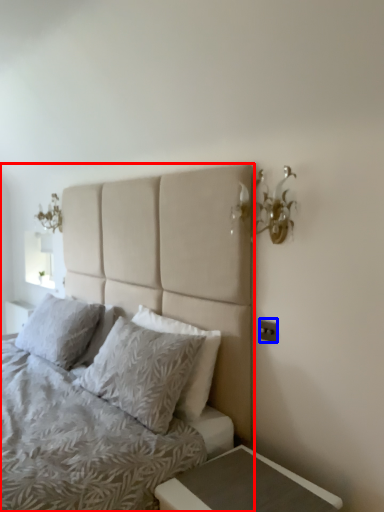
Question: Which object is closer to the camera taking this photo, bed (highlighted by a red box) or electric outlet (highlighted by a blue box)?

Choices:
 (A) bed
 (B) electric outlet

Answer: (A)